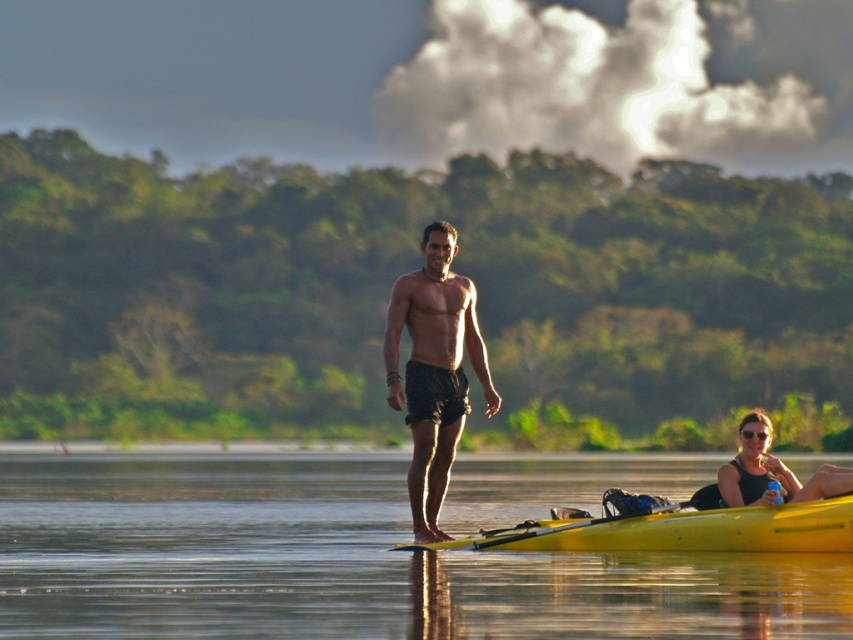
You are standing on the riverbank and see two points marked in the scene. Which point is closer to you, point (456, 438) or point (476, 541)?

Point (456, 438) is closer to you because it is further to the viewer than point (476, 541).

You are standing at the point closer to the camera in the scene. Which point are you at, point (392, 454) or point (769, 497)?

You are at point (392, 454) because it is closer to the camera than point (769, 497).